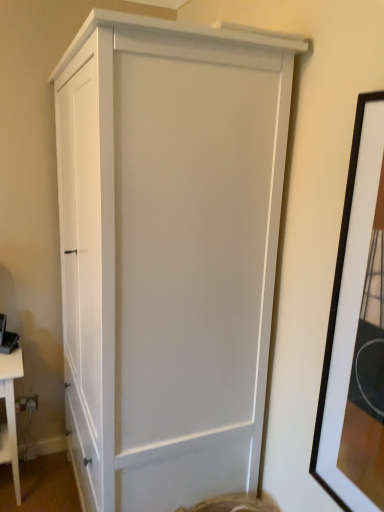
Question: Could white matte table at lower left be considered to be inside black matte picture frame at right?

Choices:
 (A) no
 (B) yes

Answer: (A)

Question: From a real-world perspective, is black matte picture frame at right over white matte table at lower left?

Choices:
 (A) no
 (B) yes

Answer: (B)

Question: Is black matte picture frame at right wider than white matte table at lower left?

Choices:
 (A) no
 (B) yes

Answer: (A)

Question: Does black matte picture frame at right come behind white matte table at lower left?

Choices:
 (A) no
 (B) yes

Answer: (A)

Question: Considering the relative sizes of black matte picture frame at right and white matte table at lower left in the image provided, is black matte picture frame at right taller than white matte table at lower left?

Choices:
 (A) yes
 (B) no

Answer: (A)

Question: Based on their sizes in the image, would you say black matte picture frame at right is bigger or smaller than white matte table at lower left?

Choices:
 (A) small
 (B) big

Answer: (A)

Question: From the image's perspective, is black matte picture frame at right above or below white matte table at lower left?

Choices:
 (A) below
 (B) above

Answer: (B)

Question: Looking at their shapes, would you say black matte picture frame at right is wider or thinner than white matte table at lower left?

Choices:
 (A) wide
 (B) thin

Answer: (B)

Question: Is black matte picture frame at right taller or shorter than white matte table at lower left?

Choices:
 (A) short
 (B) tall

Answer: (B)

Question: From a real-world perspective, is white matte table at lower left positioned above or below white matte cabinet at center?

Choices:
 (A) below
 (B) above

Answer: (A)

Question: Considering the positions of white matte table at lower left and white matte cabinet at center in the image, is white matte table at lower left bigger or smaller than white matte cabinet at center?

Choices:
 (A) big
 (B) small

Answer: (B)

Question: Is white matte table at lower left to the left or to the right of white matte cabinet at center in the image?

Choices:
 (A) right
 (B) left

Answer: (B)

Question: In terms of width, does white matte table at lower left look wider or thinner when compared to white matte cabinet at center?

Choices:
 (A) thin
 (B) wide

Answer: (A)

Question: Is white matte cabinet at center inside or outside of white matte table at lower left?

Choices:
 (A) inside
 (B) outside

Answer: (B)

Question: From a real-world perspective, is white matte cabinet at center above or below white matte table at lower left?

Choices:
 (A) below
 (B) above

Answer: (B)